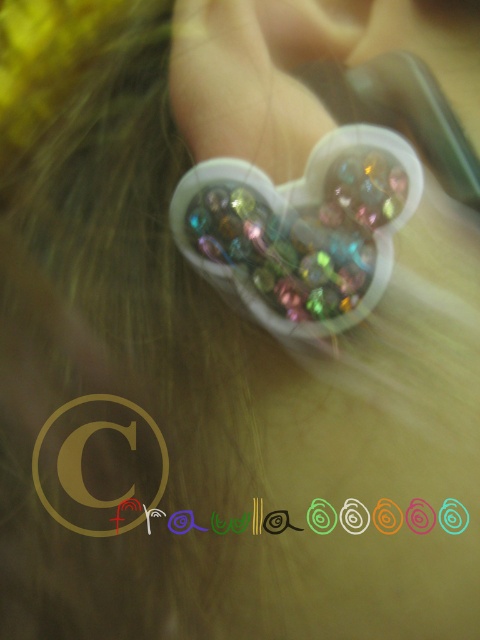
Who is higher up, shiny plastic heart at center or pearlized plastic heart at upper center?

shiny plastic heart at center is higher up.

Can you confirm if shiny plastic heart at center is taller than pearlized plastic heart at upper center?

Yes.

Identify the location of shiny plastic heart at center. (297, 236).